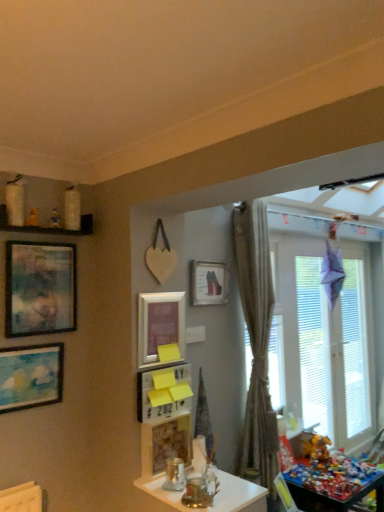
This screenshot has height=512, width=384. I want to click on empty space that is ontop of multicolored plastic toys at lower right, which is counted as the 1th table, starting from the right (from a real-world perspective), so click(x=324, y=469).